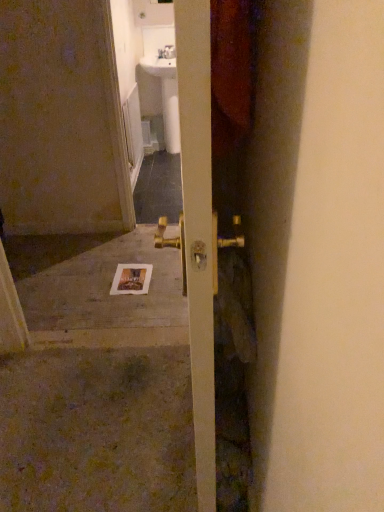
Question: Is white paper postcard at center not near gold metallic door handle at center?

Choices:
 (A) yes
 (B) no

Answer: (A)

Question: Does white paper postcard at center have a greater width compared to gold metallic door handle at center?

Choices:
 (A) yes
 (B) no

Answer: (A)

Question: Considering the relative sizes of white paper postcard at center and gold metallic door handle at center in the image provided, is white paper postcard at center shorter than gold metallic door handle at center?

Choices:
 (A) yes
 (B) no

Answer: (A)

Question: Is white paper postcard at center behind gold metallic door handle at center?

Choices:
 (A) no
 (B) yes

Answer: (B)

Question: Considering the relative sizes of white paper postcard at center and gold metallic door handle at center in the image provided, is white paper postcard at center thinner than gold metallic door handle at center?

Choices:
 (A) yes
 (B) no

Answer: (B)

Question: Is white concrete at center spatially inside white paper postcard at center, or outside of it?

Choices:
 (A) inside
 (B) outside

Answer: (B)

Question: From a real-world perspective, is white concrete at center positioned above or below white paper postcard at center?

Choices:
 (A) above
 (B) below

Answer: (B)

Question: Is point (145, 251) positioned closer to the camera than point (148, 266)?

Choices:
 (A) farther
 (B) closer

Answer: (A)

Question: Considering their positions, is white concrete at center located in front of or behind white paper postcard at center?

Choices:
 (A) behind
 (B) front

Answer: (B)

Question: Based on their sizes in the image, would you say white paper postcard at center is bigger or smaller than white concrete at center?

Choices:
 (A) big
 (B) small

Answer: (B)

Question: From a real-world perspective, is white paper postcard at center above or below white concrete at center?

Choices:
 (A) below
 (B) above

Answer: (B)

Question: Is white paper postcard at center to the left or to the right of white concrete at center in the image?

Choices:
 (A) left
 (B) right

Answer: (B)

Question: From their relative heights in the image, would you say white paper postcard at center is taller or shorter than white concrete at center?

Choices:
 (A) short
 (B) tall

Answer: (A)

Question: In the image, is gold metallic door handle at center positioned in front of or behind white glossy sink at upper center?

Choices:
 (A) front
 (B) behind

Answer: (A)

Question: Is point (226, 71) closer or farther from the camera than point (147, 70)?

Choices:
 (A) closer
 (B) farther

Answer: (A)